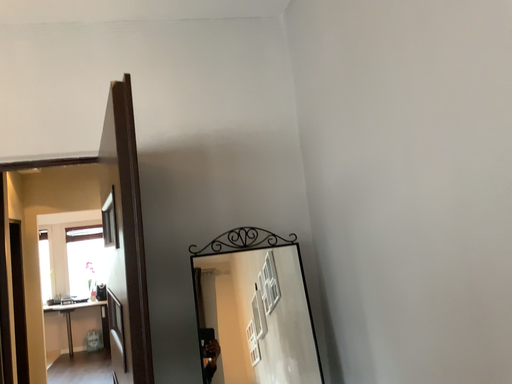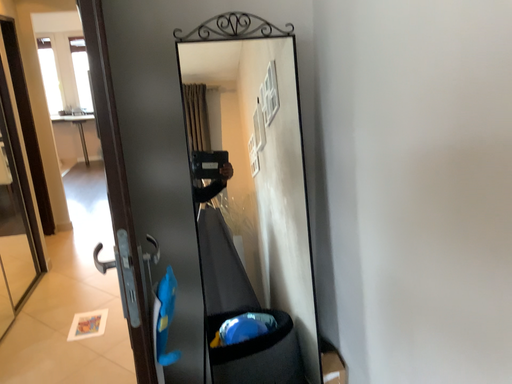
Question: How did the camera likely rotate when shooting the video?

Choices:
 (A) rotated upward
 (B) rotated downward

Answer: (B)